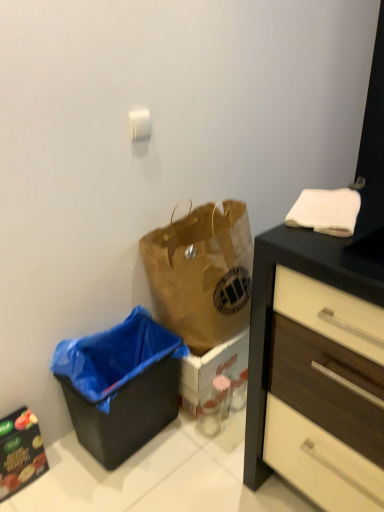
Question: Does brown paper bag at center come behind black glossy cabinet at lower left?

Choices:
 (A) no
 (B) yes

Answer: (B)

Question: From the image's perspective, is brown paper bag at center located above black glossy cabinet at lower left?

Choices:
 (A) no
 (B) yes

Answer: (B)

Question: Does brown paper bag at center turn towards black glossy cabinet at lower left?

Choices:
 (A) no
 (B) yes

Answer: (A)

Question: From a real-world perspective, is brown paper bag at center over black glossy cabinet at lower left?

Choices:
 (A) yes
 (B) no

Answer: (A)

Question: Is brown paper bag at center turned away from black glossy cabinet at lower left?

Choices:
 (A) yes
 (B) no

Answer: (B)

Question: From the image's perspective, relative to brown paper bag at center, is black glossy cabinet at lower left above or below?

Choices:
 (A) above
 (B) below

Answer: (B)

Question: Looking at their shapes, would you say black glossy cabinet at lower left is wider or thinner than brown paper bag at center?

Choices:
 (A) wide
 (B) thin

Answer: (B)

Question: Considering their positions, is black glossy cabinet at lower left located in front of or behind brown paper bag at center?

Choices:
 (A) behind
 (B) front

Answer: (B)

Question: Is point (23, 473) closer or farther from the camera than point (236, 326)?

Choices:
 (A) farther
 (B) closer

Answer: (B)

Question: Is black plastic recycling bin at lower left spatially inside black glossy cabinet at lower left, or outside of it?

Choices:
 (A) inside
 (B) outside

Answer: (B)

Question: Considering the relative positions of black plastic recycling bin at lower left and black glossy cabinet at lower left in the image provided, is black plastic recycling bin at lower left to the left or to the right of black glossy cabinet at lower left?

Choices:
 (A) right
 (B) left

Answer: (A)

Question: From the image's perspective, is black plastic recycling bin at lower left located above or below black glossy cabinet at lower left?

Choices:
 (A) below
 (B) above

Answer: (B)

Question: In the image, is black plastic recycling bin at lower left positioned in front of or behind black glossy cabinet at lower left?

Choices:
 (A) front
 (B) behind

Answer: (A)

Question: Is black glossy cabinet at lower left situated inside black plastic recycling bin at lower left or outside?

Choices:
 (A) inside
 (B) outside

Answer: (B)

Question: From a real-world perspective, is black glossy cabinet at lower left above or below black plastic recycling bin at lower left?

Choices:
 (A) below
 (B) above

Answer: (A)